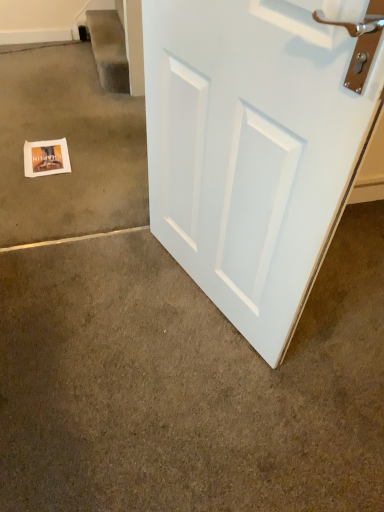
Find the location of a particular element. The height and width of the screenshot is (512, 384). free space in front of carpeted stairwell at upper left is located at coordinates (84, 97).